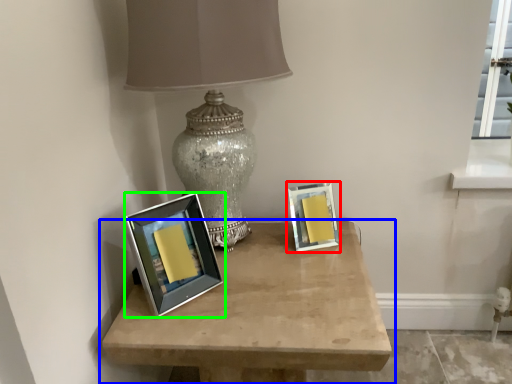
Question: Based on their relative distances, which object is nearer to picture frame (highlighted by a red box)? Choose from table (highlighted by a blue box) and picture frame (highlighted by a green box).

Choices:
 (A) table
 (B) picture frame

Answer: (A)